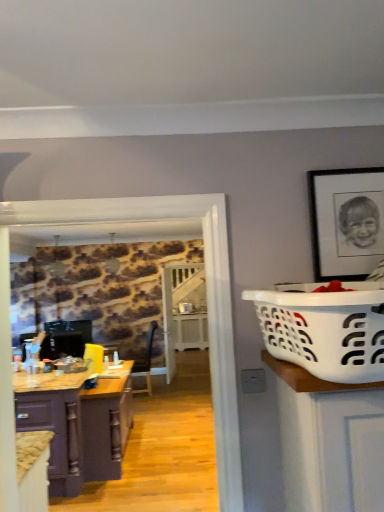
Question: Is matte purple cabinet at lower left, the 2th cabinetry when ordered from back to front, not inside white plastic laundry basket at right?

Choices:
 (A) yes
 (B) no

Answer: (A)

Question: Is matte purple cabinet at lower left, which is counted as the 1th cabinetry, starting from the front, to the right of white plastic laundry basket at right from the viewer's perspective?

Choices:
 (A) no
 (B) yes

Answer: (A)

Question: Is matte purple cabinet at lower left, the 2th cabinetry when ordered from back to front, in front of white plastic laundry basket at right?

Choices:
 (A) yes
 (B) no

Answer: (B)

Question: From the image's perspective, is matte purple cabinet at lower left, the 2th cabinetry when ordered from back to front, above white plastic laundry basket at right?

Choices:
 (A) no
 (B) yes

Answer: (A)

Question: Is matte purple cabinet at lower left, the 2th cabinetry when ordered from back to front, positioned far away from white plastic laundry basket at right?

Choices:
 (A) yes
 (B) no

Answer: (A)

Question: From the image's perspective, does matte purple cabinet at lower left, which is counted as the 1th cabinetry, starting from the front, appear lower than white plastic laundry basket at right?

Choices:
 (A) no
 (B) yes

Answer: (B)

Question: Does matte purple cabinet at lower left, which is counted as the 1th cabinetry, starting from the front, have a greater width compared to purple wood cabinet at left, acting as the 1th cabinetry starting from the back?

Choices:
 (A) yes
 (B) no

Answer: (B)

Question: Considering the relative sizes of matte purple cabinet at lower left, the 2th cabinetry when ordered from back to front, and purple wood cabinet at left, acting as the 1th cabinetry starting from the back, in the image provided, is matte purple cabinet at lower left, the 2th cabinetry when ordered from back to front, bigger than purple wood cabinet at left, acting as the 1th cabinetry starting from the back,?

Choices:
 (A) no
 (B) yes

Answer: (A)

Question: Is matte purple cabinet at lower left, the 2th cabinetry when ordered from back to front, completely or partially outside of purple wood cabinet at left, acting as the 1th cabinetry starting from the back?

Choices:
 (A) yes
 (B) no

Answer: (A)

Question: From a real-world perspective, is matte purple cabinet at lower left, the 2th cabinetry when ordered from back to front, on purple wood cabinet at left, which appears as the second cabinetry when viewed from the front?

Choices:
 (A) yes
 (B) no

Answer: (A)

Question: From the image's perspective, is matte purple cabinet at lower left, the 2th cabinetry when ordered from back to front, located beneath purple wood cabinet at left, acting as the 1th cabinetry starting from the back?

Choices:
 (A) yes
 (B) no

Answer: (B)

Question: Is matte purple cabinet at lower left, the 2th cabinetry when ordered from back to front, placed right next to purple wood cabinet at left, acting as the 1th cabinetry starting from the back?

Choices:
 (A) yes
 (B) no

Answer: (B)

Question: From a real-world perspective, is black matte picture frame at upper right positioned over matte purple cabinet at lower left, the 2th cabinetry when ordered from back to front, based on gravity?

Choices:
 (A) no
 (B) yes

Answer: (B)